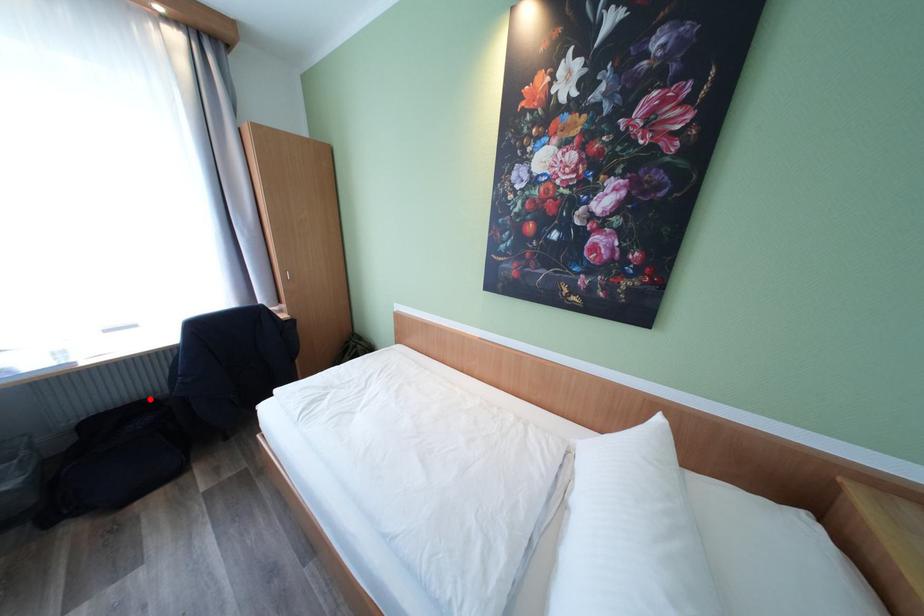
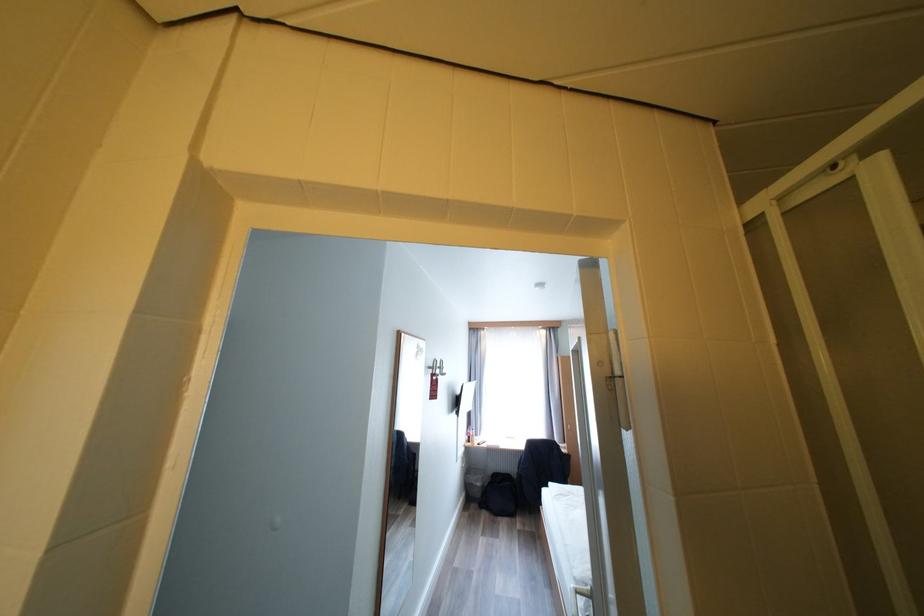
Question: I am providing you with two images of the same scene from different viewpoints. A red point is marked on the first image. At the location where the point appears in image 1, is it still visible in image 2?

Choices:
 (A) Yes
 (B) No

Answer: (A)